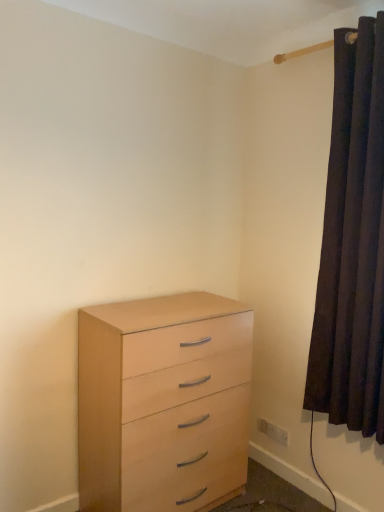
Question: Is white plastic electric outlet at lower right located within dark velvet curtain at right?

Choices:
 (A) yes
 (B) no

Answer: (B)

Question: Does dark velvet curtain at right turn towards white plastic electric outlet at lower right?

Choices:
 (A) no
 (B) yes

Answer: (A)

Question: Can you confirm if dark velvet curtain at right is taller than white plastic electric outlet at lower right?

Choices:
 (A) no
 (B) yes

Answer: (B)

Question: Is dark velvet curtain at right at the right side of white plastic electric outlet at lower right?

Choices:
 (A) no
 (B) yes

Answer: (B)

Question: Is dark velvet curtain at right at the left side of white plastic electric outlet at lower right?

Choices:
 (A) no
 (B) yes

Answer: (A)

Question: From a real-world perspective, does dark velvet curtain at right stand above white plastic electric outlet at lower right?

Choices:
 (A) no
 (B) yes

Answer: (B)

Question: From the image's perspective, is white plastic electric outlet at lower right above light wood chest of drawers at lower left?

Choices:
 (A) no
 (B) yes

Answer: (A)

Question: Is white plastic electric outlet at lower right in front of light wood chest of drawers at lower left?

Choices:
 (A) yes
 (B) no

Answer: (B)

Question: From a real-world perspective, is white plastic electric outlet at lower right under light wood chest of drawers at lower left?

Choices:
 (A) yes
 (B) no

Answer: (A)

Question: Is white plastic electric outlet at lower right aimed at light wood chest of drawers at lower left?

Choices:
 (A) yes
 (B) no

Answer: (A)

Question: Is white plastic electric outlet at lower right positioned far away from light wood chest of drawers at lower left?

Choices:
 (A) no
 (B) yes

Answer: (A)

Question: Does white plastic electric outlet at lower right have a lesser width compared to light wood chest of drawers at lower left?

Choices:
 (A) no
 (B) yes

Answer: (B)

Question: Can you confirm if dark velvet curtain at right is smaller than light wood chest of drawers at lower left?

Choices:
 (A) yes
 (B) no

Answer: (A)